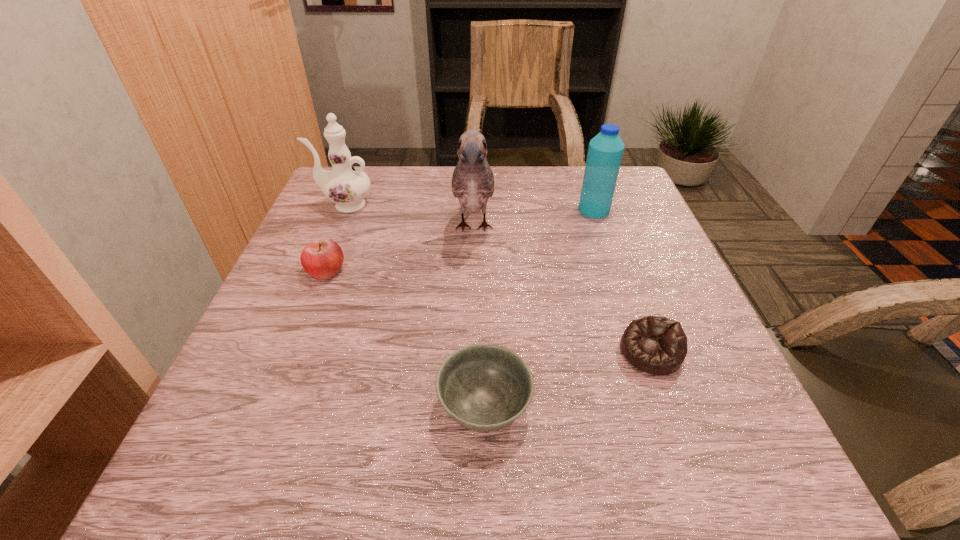
You are a GUI agent. You are given a task and a screenshot of the screen. Output one action in this format:
    pyautogui.click(x=<x>, y=<y>)
    Task: Click on the free spot that satisfies the following two spatial constraints: 1. on the front-facing side of the parrot; 2. on the right side of the shortest object
    The height and width of the screenshot is (540, 960).
    Given the screenshot: What is the action you would take?
    pyautogui.click(x=471, y=352)

Locate an element on the screen. The height and width of the screenshot is (540, 960). free space that satisfies the following two spatial constraints: 1. at the spout of the chinaware; 2. on the right side of the shortest object is located at coordinates (283, 352).

The height and width of the screenshot is (540, 960). I want to click on free region that satisfies the following two spatial constraints: 1. at the spout of the water bottle; 2. on the left side of the chinaware, so click(343, 210).

Where is `vacant region that satisfies the following two spatial constraints: 1. at the spout of the beanbag; 2. on the left side of the chinaware`? Image resolution: width=960 pixels, height=540 pixels. vacant region that satisfies the following two spatial constraints: 1. at the spout of the beanbag; 2. on the left side of the chinaware is located at coordinates (283, 352).

At what (x,y) coordinates should I click in order to perform the action: click on free location that satisfies the following two spatial constraints: 1. on the front side of the bowl; 2. on the left side of the apple. Please return your answer as a coordinate pair (x, y). The image size is (960, 540). Looking at the image, I should click on tap(273, 407).